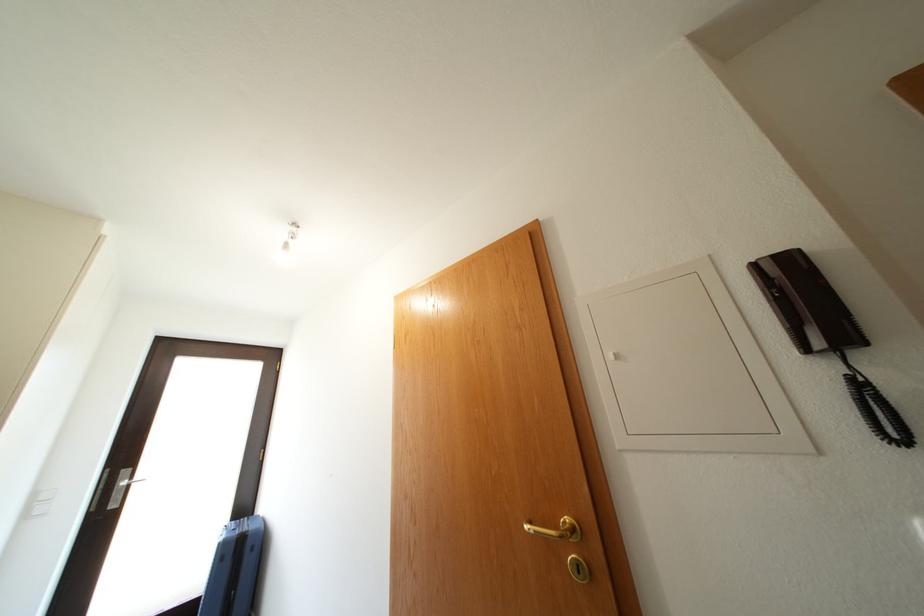
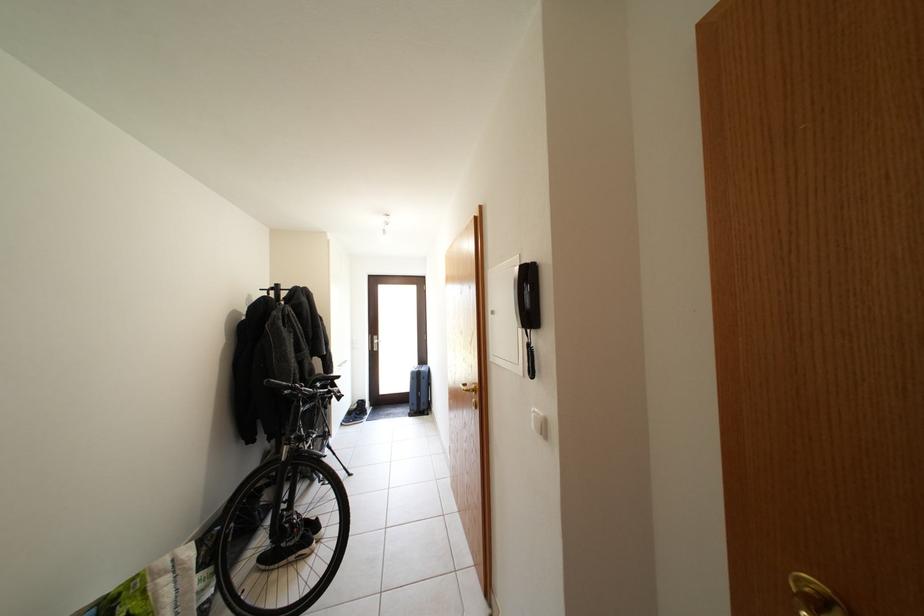
Find the pixel in the second image that matches (x=233, y=549) in the first image.

(420, 379)